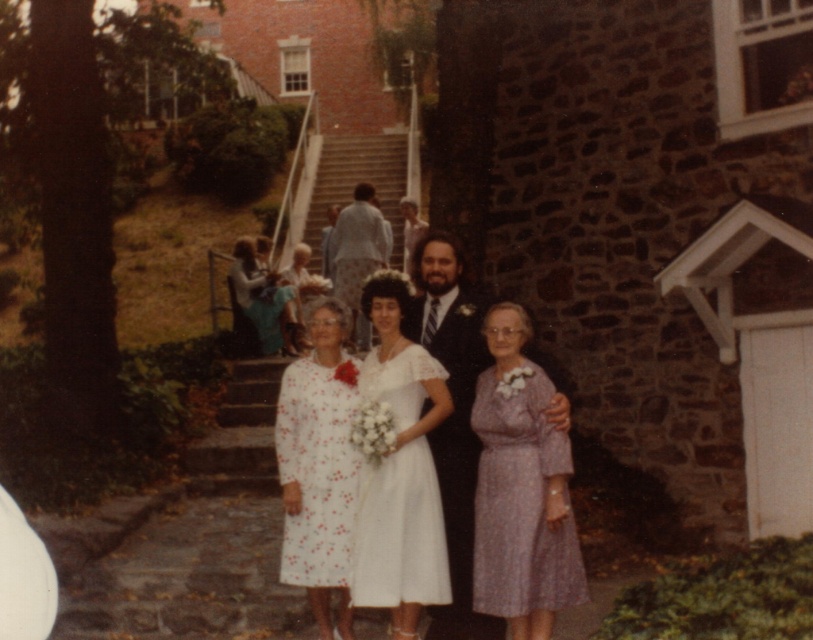
Question: Which object appears closest to the camera in this image?

Choices:
 (A) matte green dress at center
 (B) purple satin dress at lower right
 (C) white lace dress at center
 (D) light blue fabric shirt at center

Answer: (B)

Question: Is white lace dress at center positioned behind black satin suit at center?

Choices:
 (A) yes
 (B) no

Answer: (B)

Question: Is purple satin dress at lower right smaller than matte green dress at center?

Choices:
 (A) yes
 (B) no

Answer: (A)

Question: Is white lace dress at center thinner than matte green dress at center?

Choices:
 (A) no
 (B) yes

Answer: (B)

Question: Which is farther from the white lace dress at center?

Choices:
 (A) black satin suit at center
 (B) matte green dress at center
 (C) purple satin dress at lower right
 (D) light blue fabric shirt at center

Answer: (D)

Question: Which object is farther from the camera taking this photo?

Choices:
 (A) white floral-patterned dress at center
 (B) purple satin dress at lower right
 (C) white lace dress at center

Answer: (A)